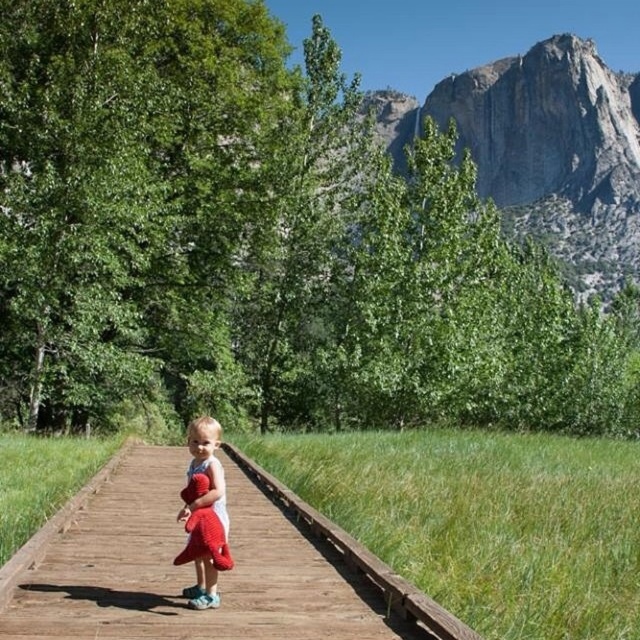
You are a parent trying to ensure your child stays safe on the wooden boardwalk at center while holding the soft plush toy at center. Since the boardwalk is narrow, can you estimate if the child can walk safely while holding the toy?

The wooden boardwalk at center is bigger than the soft plush toy at center, so yes, the child can walk safely while holding the soft plush toy at center as the boardwalk provides enough space.

You are a drone operator and need to fly a drone to the wooden boardwalk at center. According to the coordinates provided, where should you direct the drone to land?

The wooden boardwalk at center is located at coordinates point (186, 570), so you should direct the drone to land there.